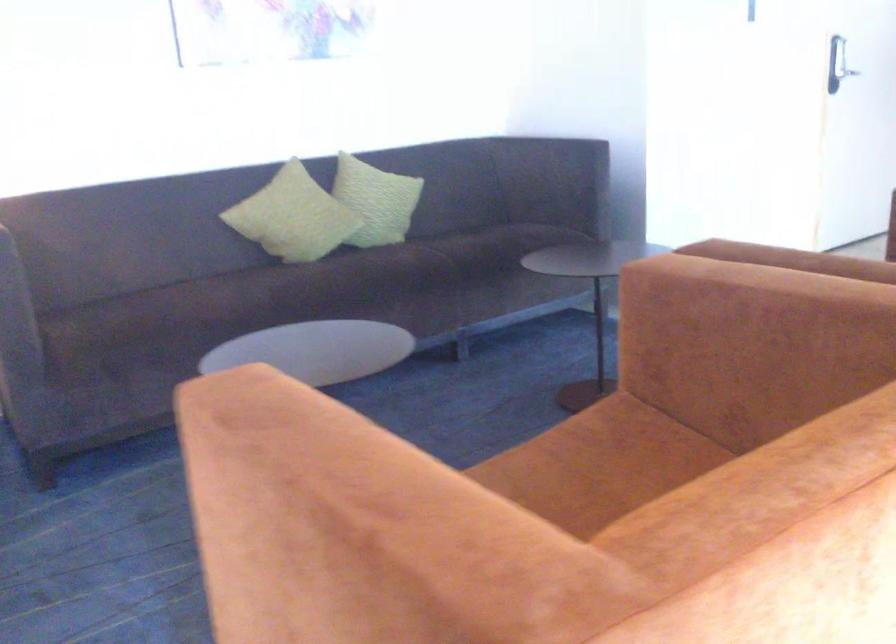
Find the location of a particular element. green patterned pillow is located at coordinates (293, 216).